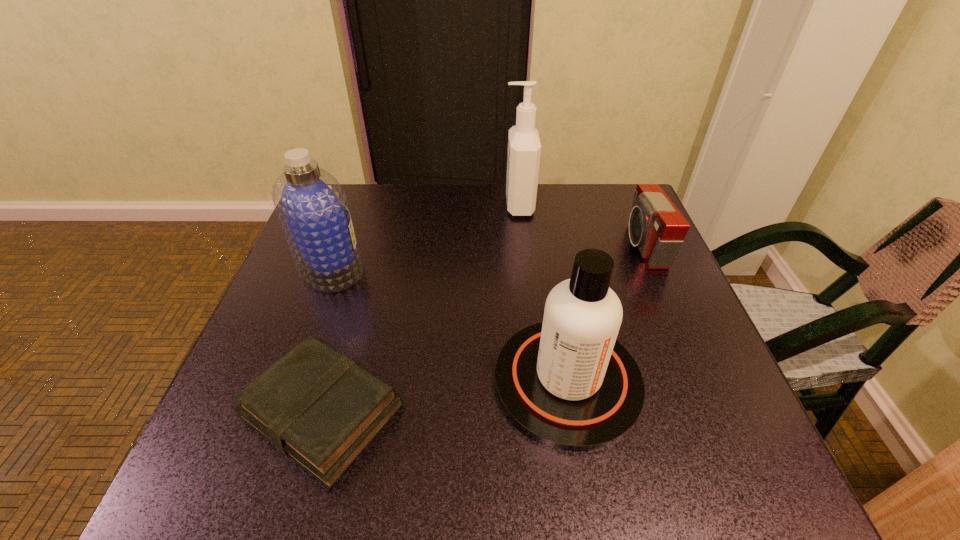
Where is `free spot located 0.230m on the back of the nearest cleansing agent`? The height and width of the screenshot is (540, 960). free spot located 0.230m on the back of the nearest cleansing agent is located at coordinates (546, 254).

Identify the location of free space located 0.080m on the front-facing side of the camera. The image size is (960, 540). (595, 246).

Where is `vacant space located on the front-facing side of the camera`? The image size is (960, 540). vacant space located on the front-facing side of the camera is located at coordinates (567, 246).

At what (x,y) coordinates should I click in order to perform the action: click on free location located on the front-facing side of the camera. Please return your answer as a coordinate pair (x, y). This screenshot has width=960, height=540. Looking at the image, I should click on (604, 246).

Find the location of a particular element. This screenshot has height=540, width=960. free space located on the right of the book is located at coordinates (518, 411).

The height and width of the screenshot is (540, 960). In order to click on cleansing agent that is at the far edge in this screenshot , I will do `click(524, 147)`.

At what (x,y) coordinates should I click in order to perform the action: click on camera that is positioned at the far edge. Please return your answer as a coordinate pair (x, y). The image size is (960, 540). Looking at the image, I should click on (656, 226).

The width and height of the screenshot is (960, 540). I want to click on cleansing agent located at the near edge, so click(566, 382).

At what (x,y) coordinates should I click in order to perform the action: click on book located in the near edge section of the desktop. Please return your answer as a coordinate pair (x, y). Looking at the image, I should click on (318, 407).

I want to click on cleansing agent present at the left edge, so click(x=313, y=210).